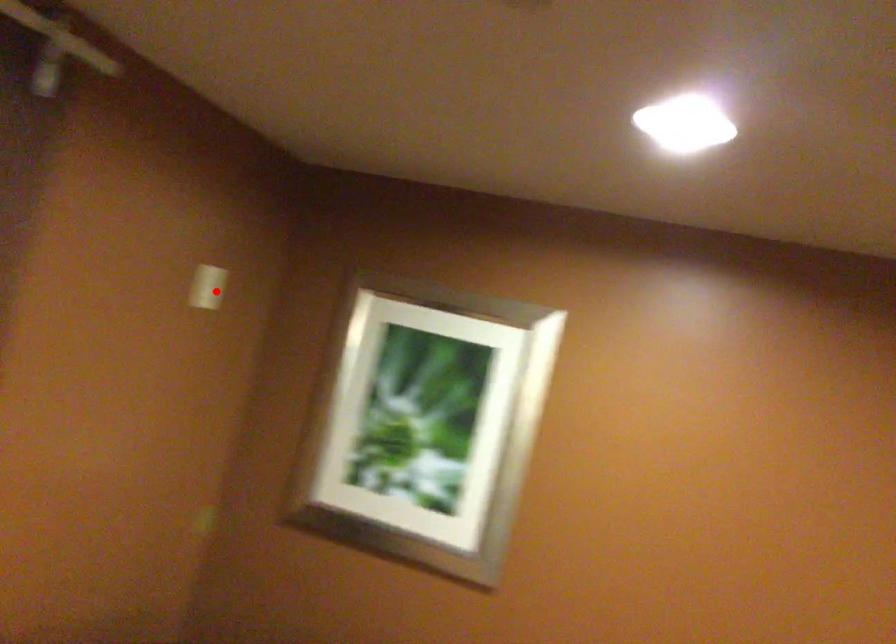
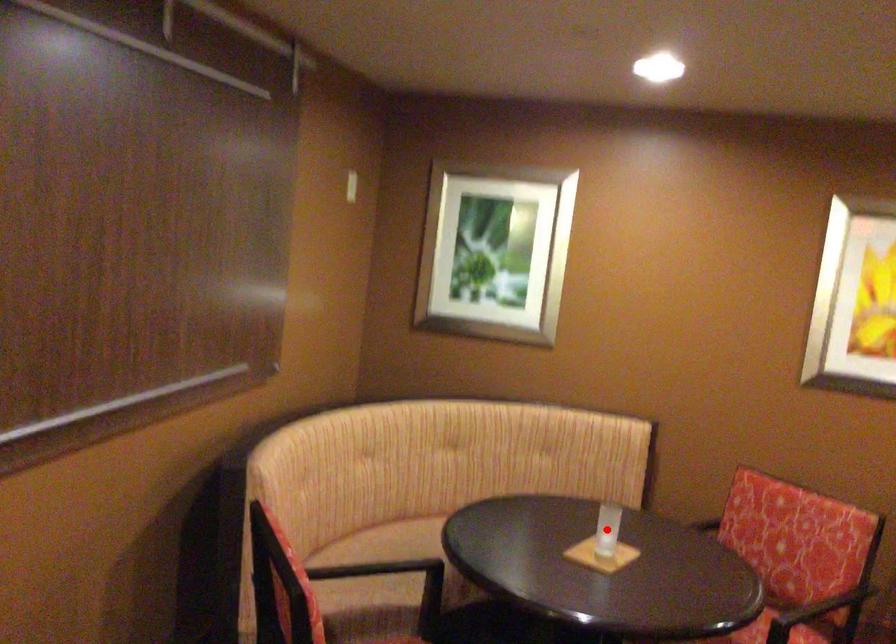
I am providing you with two images of the same scene from different viewpoints. A red point is marked on the first image and another point is marked on the second image. Are the points marked in image1 and image2 representing the same 3D position?

No